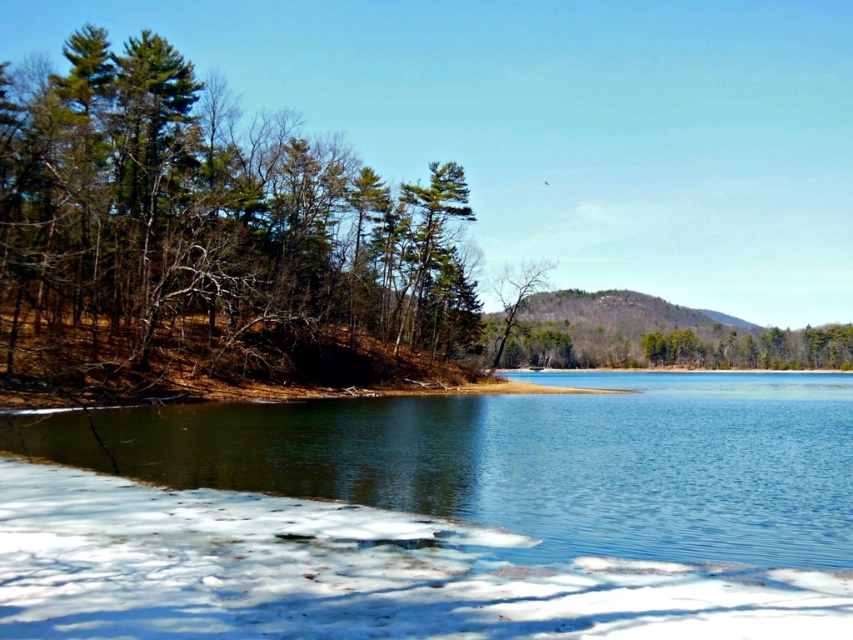
Who is more forward, (740, 550) or (540, 289)?

Point (740, 550) is in front.

Does point (273, 442) come farther from viewer compared to point (537, 280)?

No, (273, 442) is closer to viewer.

Who is more distant from viewer, (567, 472) or (503, 294)?

Positioned behind is point (503, 294).

In order to click on clear water at lower center in this screenshot , I will do `click(548, 461)`.

Does green textured trees at left appear on the right side of bare branches at center?

In fact, green textured trees at left is to the left of bare branches at center.

This screenshot has height=640, width=853. What do you see at coordinates (207, 234) in the screenshot?
I see `green textured trees at left` at bounding box center [207, 234].

Is point (189, 314) positioned behind point (527, 273)?

No, it is not.

At what (x,y) coordinates should I click in order to perform the action: click on green textured trees at left. Please return your answer as a coordinate pair (x, y). The image size is (853, 640). Looking at the image, I should click on (207, 234).

Is green textured trees at left wider than clear water at lower center?

No.

Which is more to the right, green textured trees at left or clear water at lower center?

Positioned to the right is clear water at lower center.

Between point (109, 250) and point (366, 460), which one is positioned behind?

Point (109, 250)

Find the location of a particular element. The width and height of the screenshot is (853, 640). green textured trees at left is located at coordinates (207, 234).